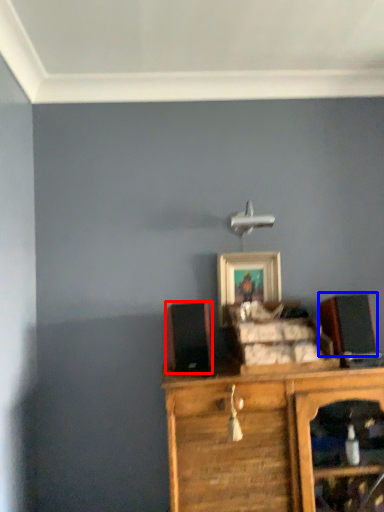
Question: Which of the following is the farthest to the observer, speaker (highlighted by a red box) or speaker (highlighted by a blue box)?

Choices:
 (A) speaker
 (B) speaker

Answer: (B)